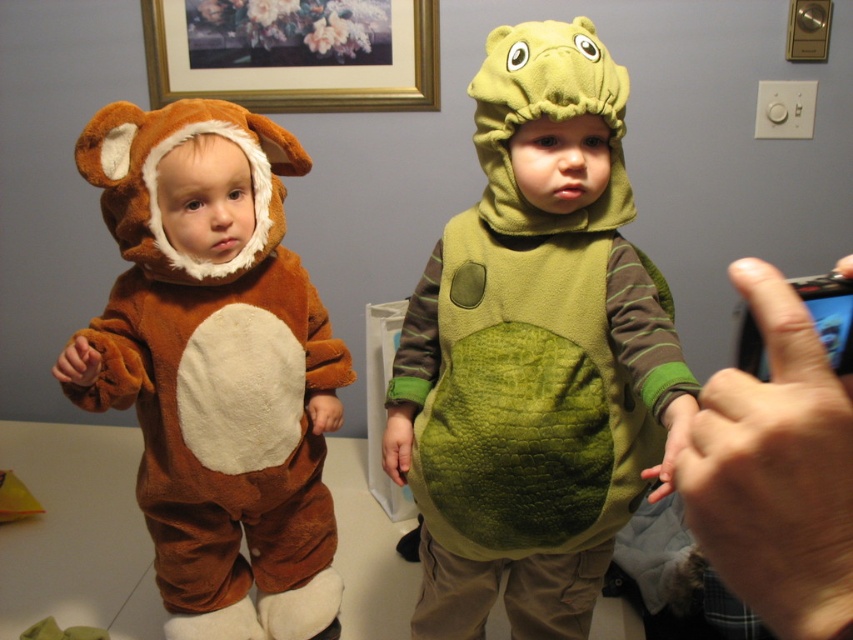
Who is lower down, velvety green dinosaur costume at center or smooth black phone at right?

Positioned lower is velvety green dinosaur costume at center.

Who is more distant from viewer, [646,314] or [793,589]?

The point [646,314] is behind.

This screenshot has height=640, width=853. I want to click on velvety green dinosaur costume at center, so click(534, 353).

This screenshot has height=640, width=853. I want to click on velvety green dinosaur costume at center, so click(x=534, y=353).

Measure the distance between brown plush bear at left and camera.

brown plush bear at left and camera are 1.01 meters apart.

Is brown plush bear at left smaller than smooth black phone at right?

No.

Is point (111, 396) positioned before point (840, 476)?

No, (111, 396) is further to viewer.

I want to click on brown plush bear at left, so click(x=215, y=365).

Who is higher up, velvety green dinosaur costume at center or brown plush bear at left?

velvety green dinosaur costume at center is higher up.

Locate an element on the screen. This screenshot has height=640, width=853. velvety green dinosaur costume at center is located at coordinates (534, 353).